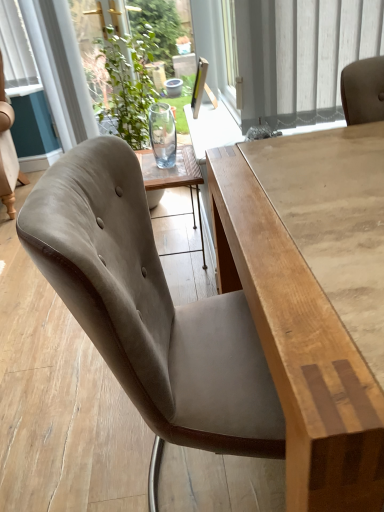
This screenshot has width=384, height=512. Describe the element at coordinates (313, 297) in the screenshot. I see `light brown wood table at center` at that location.

Identify the location of light brown wood table at center. The image size is (384, 512). (313, 297).

The height and width of the screenshot is (512, 384). In order to click on light brown wood table at center in this screenshot , I will do `click(313, 297)`.

In terms of height, does suede-like beige chair at center look taller or shorter compared to light brown wood table at center?

Clearly, suede-like beige chair at center is shorter compared to light brown wood table at center.

Where is `table located above the suede-like beige chair at center (from a real-world perspective)`? table located above the suede-like beige chair at center (from a real-world perspective) is located at coordinates (x=313, y=297).

Is suede-like beige chair at center next to light brown wood table at center and touching it?

suede-like beige chair at center and light brown wood table at center are not in contact.

Can light brown wood table at center be found inside suede-like beige chair at center?

That's incorrect, light brown wood table at center is not inside suede-like beige chair at center.

Which point is more forward, (x=170, y=26) or (x=285, y=202)?

The point (x=285, y=202) is in front.

The image size is (384, 512). I want to click on window screen lying above the light brown wood table at center (from the image's perspective), so click(162, 26).

Consider the image. From the image's perspective, would you say transparent glass vase at upper center is shown under light brown wood table at center?

No, from the image's perspective, transparent glass vase at upper center is not beneath light brown wood table at center.

Are transparent glass vase at upper center and light brown wood table at center located far from each other?

Yes, transparent glass vase at upper center and light brown wood table at center are quite far apart.

Looking at this image, measure the distance from light brown wood table at center to transparent glass vase at upper center.

A distance of 4.64 feet exists between light brown wood table at center and transparent glass vase at upper center.

From a real-world perspective, which object stands above the other?

transparent glass vase at upper center is physically above.

Is light brown wood table at center far away from transparent glass vase at upper center?

Yes, light brown wood table at center and transparent glass vase at upper center are located far from each other.

From the image's perspective, does light brown wood table at center appear higher than transparent glass vase at upper center?

No.

What's the angular difference between light brown wood table at center and suede-like beige chair at center's facing directions?

The angular difference between light brown wood table at center and suede-like beige chair at center is 1.37 degrees.

From the image's perspective, is light brown wood table at center on suede-like beige chair at center?

Incorrect, from the image's perspective, light brown wood table at center is lower than suede-like beige chair at center.

Does light brown wood table at center turn towards suede-like beige chair at center?

No, light brown wood table at center is not facing towards suede-like beige chair at center.

Does light brown wood table at center have a smaller size compared to suede-like beige chair at center?

No, light brown wood table at center is not smaller than suede-like beige chair at center.

Is transparent glass vase at upper center turned away from suede-like beige chair at center?

No.

Is transparent glass vase at upper center wider than suede-like beige chair at center?

Incorrect, the width of transparent glass vase at upper center does not surpass that of suede-like beige chair at center.

Find the location of `window screen above the suede-like beige chair at center (from the image's perspective)`. window screen above the suede-like beige chair at center (from the image's perspective) is located at coordinates (162, 26).

Considering the positions of points (80, 0) and (173, 367), is point (80, 0) farther from camera compared to point (173, 367)?

Yes, it is behind point (173, 367).

Is point (74, 176) positioned behind point (84, 16)?

No, it is in front of (84, 16).

Is transparent glass vase at upper center at the back of suede-like beige chair at center?

No, suede-like beige chair at center is not facing the opposite direction of transparent glass vase at upper center.

Is the surface of suede-like beige chair at center in direct contact with transparent glass vase at upper center?

There is a gap between suede-like beige chair at center and transparent glass vase at upper center.

From the image's perspective, is suede-like beige chair at center located above or below transparent glass vase at upper center?

Based on their image positions, suede-like beige chair at center is located beneath transparent glass vase at upper center.

You are a GUI agent. You are given a task and a screenshot of the screen. Output one action in this format:
    pyautogui.click(x=<x>, y=<y>)
    Task: Click on the chair above the light brown wood table at center (from the image's perspective)
    
    Given the screenshot: What is the action you would take?
    pyautogui.click(x=149, y=308)

This screenshot has height=512, width=384. I want to click on window screen on the left of the light brown wood table at center, so click(x=162, y=26).

From the image, which object appears to be nearer to light brown wood table at center, transparent glass vase at upper center or suede-like beige chair at center?

Based on the image, suede-like beige chair at center appears to be nearer to light brown wood table at center.

Which object lies nearer to the anchor point transparent glass vase at upper center, light brown wood table at center or suede-like beige chair at center?

light brown wood table at center.

Which object lies further to the anchor point suede-like beige chair at center, transparent glass vase at upper center or light brown wood table at center?

transparent glass vase at upper center lies further to suede-like beige chair at center than the other object.

Estimate the real-world distances between objects in this image. Which object is closer to light brown wood table at center, suede-like beige chair at center or transparent glass vase at upper center?

Among the two, suede-like beige chair at center is located nearer to light brown wood table at center.

Based on their spatial positions, is suede-like beige chair at center or light brown wood table at center closer to transparent glass vase at upper center?

Among the two, light brown wood table at center is located nearer to transparent glass vase at upper center.

Based on their spatial positions, is light brown wood table at center or transparent glass vase at upper center closer to suede-like beige chair at center?

Based on the image, light brown wood table at center appears to be nearer to suede-like beige chair at center.

Where is `chair located between light brown wood table at center and transparent glass vase at upper center in the depth direction`? This screenshot has width=384, height=512. chair located between light brown wood table at center and transparent glass vase at upper center in the depth direction is located at coordinates (149, 308).